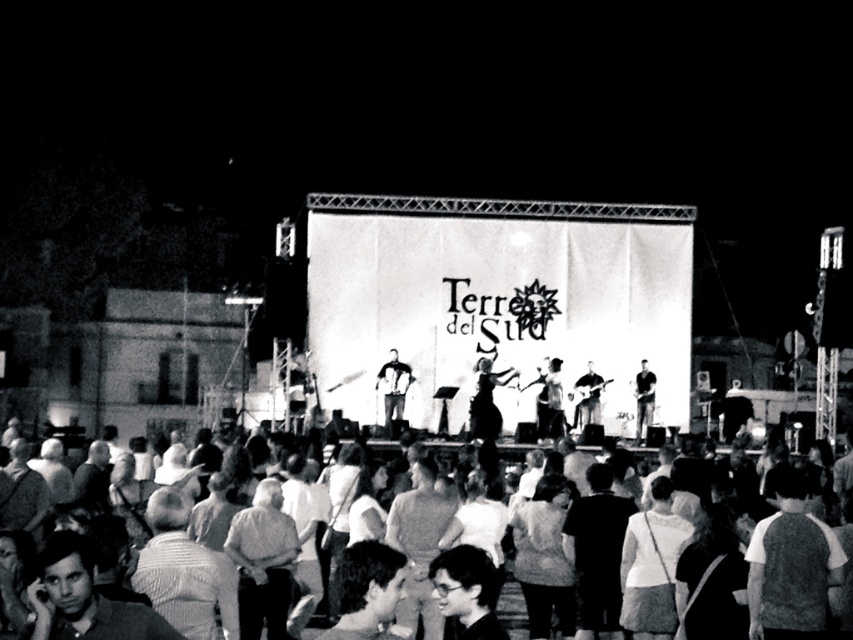
Does point (392, 408) come farther from viewer compared to point (654, 388)?

No, it is in front of (654, 388).

Is matte black accordion at center thinner than dark gray fabric guitar at center?

No, matte black accordion at center is not thinner than dark gray fabric guitar at center.

Does point (376, 374) come behind point (648, 426)?

No, (376, 374) is in front of (648, 426).

Identify the location of matte black accordion at center. (393, 388).

This screenshot has width=853, height=640. I want to click on smooth fabric dress at center, so click(x=486, y=401).

Can you confirm if smooth fabric dress at center is smaller than smooth black shirt at center?

Actually, smooth fabric dress at center might be larger than smooth black shirt at center.

Find the location of `smooth fabric dress at center`. smooth fabric dress at center is located at coordinates (486, 401).

Is point (508, 378) farther from camera compared to point (589, 412)?

Yes, it is behind point (589, 412).

At what (x,y) coordinates should I click in order to perform the action: click on smooth fabric dress at center. Please return your answer as a coordinate pair (x, y). Image resolution: width=853 pixels, height=640 pixels. Looking at the image, I should click on (486, 401).

Which is in front, point (494, 413) or point (579, 413)?

Positioned in front is point (494, 413).

At what (x,y) coordinates should I click in order to perform the action: click on smooth fabric dress at center. Please return your answer as a coordinate pair (x, y). The width and height of the screenshot is (853, 640). Looking at the image, I should click on (486, 401).